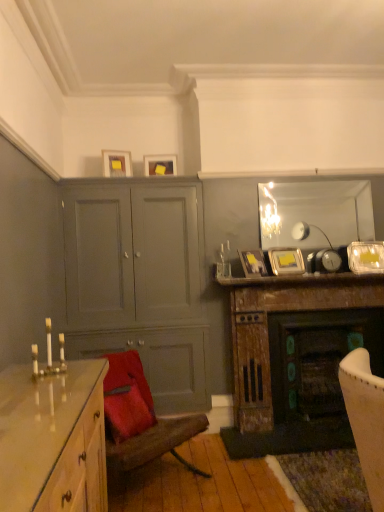
This screenshot has height=512, width=384. Identify the location of blank space situated above clear glass mirror at upper center (from a real-world perspective). (313, 180).